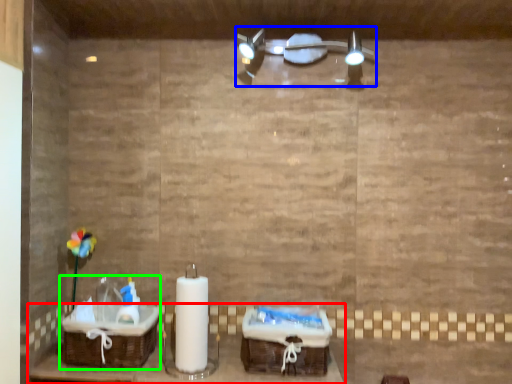
Question: Estimate the real-world distances between objects in this image. Which object is farther from furniture (highlighted by a red box), light fixture (highlighted by a blue box) or sink (highlighted by a green box)?

Choices:
 (A) light fixture
 (B) sink

Answer: (A)